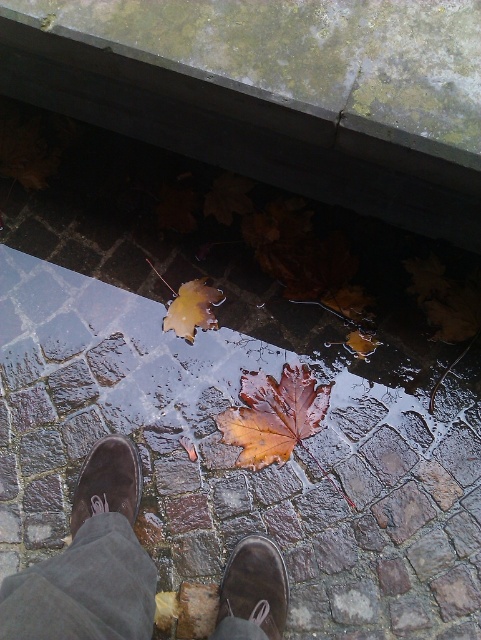
Is brown suede shoes at center to the right of brown suede shoe at lower left from the viewer's perspective?

Indeed, brown suede shoes at center is positioned on the right side of brown suede shoe at lower left.

Between brown suede shoes at center and brown suede shoe at lower left, which one has more height?

brown suede shoes at center is taller.

Does point (268, 564) lie in front of point (91, 502)?

Yes, it is.

Locate an element on the screen. brown suede shoes at center is located at coordinates (89, 561).

Does brown matte leaf at center appear on the right side of brown suede shoe at lower left?

Indeed, brown matte leaf at center is positioned on the right side of brown suede shoe at lower left.

Locate an element on the screen. brown matte leaf at center is located at coordinates [274, 416].

Can you confirm if wet stone pavement at center is positioned above brown suede shoe at lower center?

Yes, wet stone pavement at center is above brown suede shoe at lower center.

Which of these two, wet stone pavement at center or brown suede shoe at lower center, stands taller?

Standing taller between the two is wet stone pavement at center.

Between point (215, 566) and point (278, 598), which one is positioned behind?

Positioned behind is point (215, 566).

Find the location of a particular element. wet stone pavement at center is located at coordinates (235, 460).